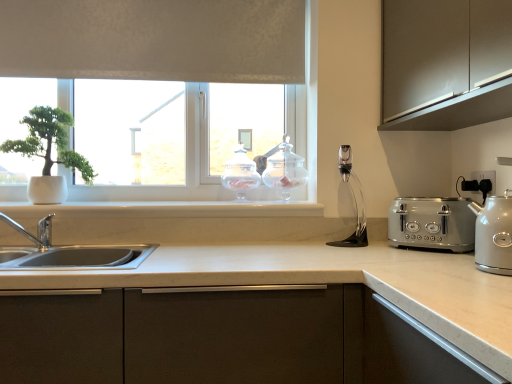
Question: Is satin silver kettle at right not close to white matte window at upper center?

Choices:
 (A) no
 (B) yes

Answer: (B)

Question: Does satin silver kettle at right have a greater width compared to white matte window at upper center?

Choices:
 (A) yes
 (B) no

Answer: (A)

Question: From the image's perspective, would you say satin silver kettle at right is positioned over white matte window at upper center?

Choices:
 (A) no
 (B) yes

Answer: (A)

Question: Considering the relative positions of satin silver kettle at right and white matte window at upper center in the image provided, is satin silver kettle at right behind white matte window at upper center?

Choices:
 (A) yes
 (B) no

Answer: (B)

Question: Can you confirm if satin silver kettle at right is thinner than white matte window at upper center?

Choices:
 (A) yes
 (B) no

Answer: (B)

Question: Relative to clear glass jar at upper center, marked as the 1th appliance in a right-to-left arrangement, is satin silver kettle at right in front or behind?

Choices:
 (A) front
 (B) behind

Answer: (A)

Question: Is satin silver kettle at right inside the boundaries of clear glass jar at upper center, marked as the 1th appliance in a right-to-left arrangement, or outside?

Choices:
 (A) inside
 (B) outside

Answer: (B)

Question: From the image's perspective, is satin silver kettle at right located above or below clear glass jar at upper center, which is the second appliance in left-to-right order?

Choices:
 (A) below
 (B) above

Answer: (A)

Question: Visually, is satin silver kettle at right positioned to the left or to the right of clear glass jar at upper center, which is the second appliance in left-to-right order?

Choices:
 (A) left
 (B) right

Answer: (B)

Question: From the image's perspective, is clear glass jar at upper center, marked as the 1th appliance in a right-to-left arrangement, above or below white matte window at upper center?

Choices:
 (A) above
 (B) below

Answer: (B)

Question: In terms of size, does clear glass jar at upper center, marked as the 1th appliance in a right-to-left arrangement, appear bigger or smaller than white matte window at upper center?

Choices:
 (A) big
 (B) small

Answer: (B)

Question: In the image, is clear glass jar at upper center, which is the second appliance in left-to-right order, on the left side or the right side of white matte window at upper center?

Choices:
 (A) right
 (B) left

Answer: (A)

Question: Is clear glass jar at upper center, which is the second appliance in left-to-right order, taller or shorter than white matte window at upper center?

Choices:
 (A) short
 (B) tall

Answer: (A)

Question: From the image's perspective, is white plastic electric outlet at right positioned above or below clear glass jar at center, arranged as the second appliance when viewed from the right?

Choices:
 (A) above
 (B) below

Answer: (B)

Question: Is white plastic electric outlet at right wider or thinner than clear glass jar at center, arranged as the second appliance when viewed from the right?

Choices:
 (A) thin
 (B) wide

Answer: (A)